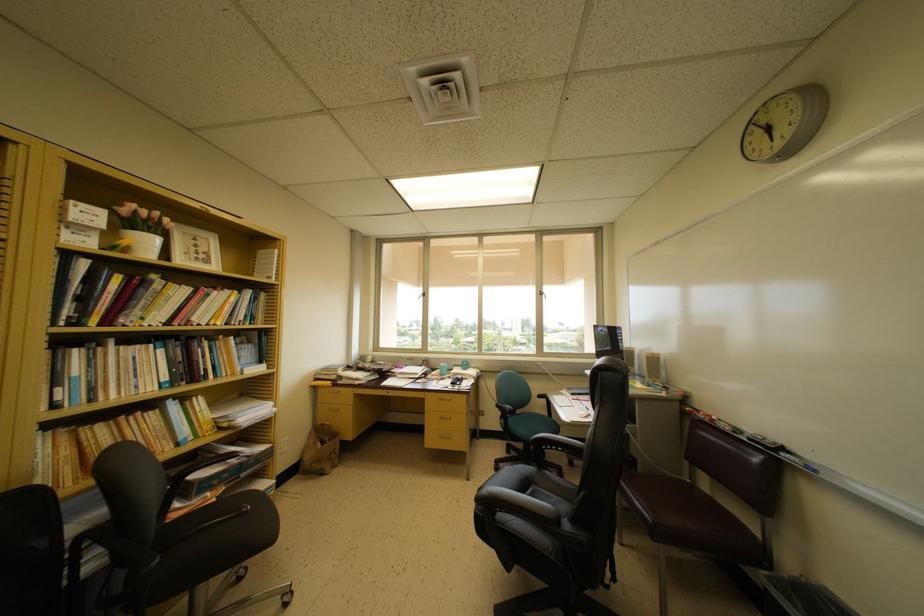
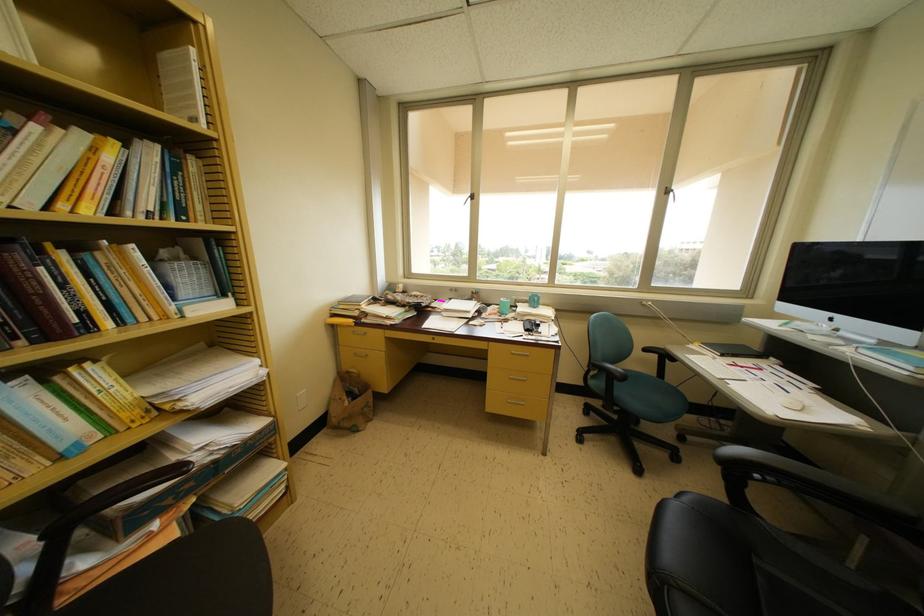
The point at [512,415] is marked in the first image. Where is the corresponding point in the second image?

(622, 379)